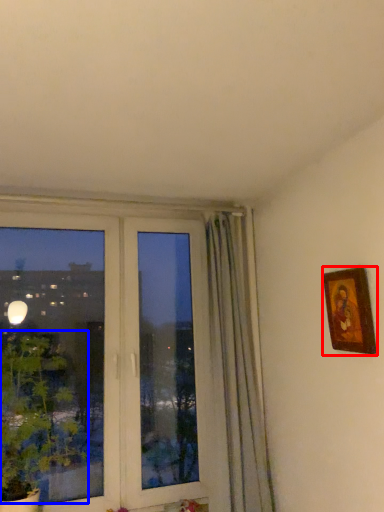
Question: Which object appears closest to the camera in this image, picture frame (highlighted by a red box) or plant (highlighted by a blue box)?

Choices:
 (A) picture frame
 (B) plant

Answer: (A)